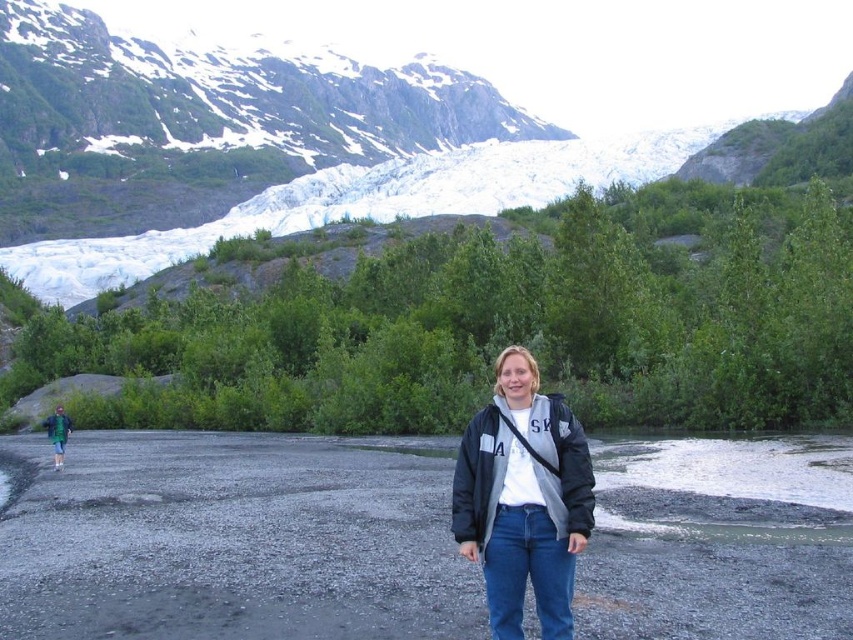
Question: Among these points, which one is farthest from the camera?

Choices:
 (A) (61, 436)
 (B) (550, 474)

Answer: (A)

Question: Can you confirm if white snow-covered mountain at upper center is positioned above green fabric jacket at lower left?

Choices:
 (A) no
 (B) yes

Answer: (B)

Question: Which point is farther to the camera?

Choices:
 (A) matte gray jacket at center
 (B) white snow-covered mountain at upper center

Answer: (B)

Question: Can you confirm if white snow-covered mountain at upper center is positioned below green fabric jacket at lower left?

Choices:
 (A) yes
 (B) no

Answer: (B)

Question: Is white snow-covered mountain at upper center thinner than green fabric jacket at lower left?

Choices:
 (A) no
 (B) yes

Answer: (A)

Question: Which point is farther to the camera?

Choices:
 (A) matte gray jacket at center
 (B) white snow-covered mountain at upper center

Answer: (B)